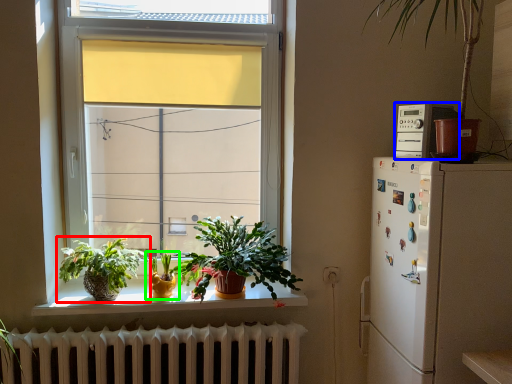
Question: Which object is the closest to the houseplant (highlighted by a red box)? Choose among these: appliance (highlighted by a blue box) or houseplant (highlighted by a green box).

Choices:
 (A) appliance
 (B) houseplant

Answer: (B)